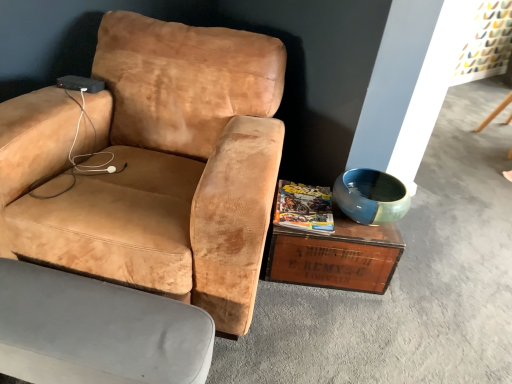
Identify the location of free space above matte yellow magazine at center (from a real-world perspective). The width and height of the screenshot is (512, 384). (306, 210).